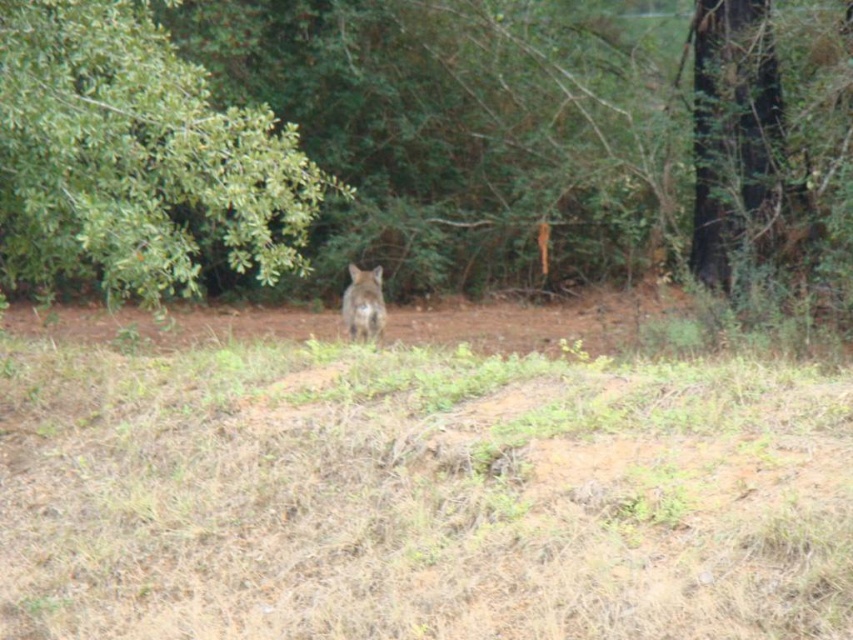
Is green leafy tree at upper left thinner than brown rough bark tree at upper right?

In fact, green leafy tree at upper left might be wider than brown rough bark tree at upper right.

Is the position of green leafy tree at upper left more distant than that of brown rough bark tree at upper right?

No, it is not.

Find the location of a particular element. This screenshot has width=853, height=640. green leafy tree at upper left is located at coordinates (136, 160).

Find the location of `green leafy tree at upper left`. green leafy tree at upper left is located at coordinates (136, 160).

Does point (729, 65) come farther from viewer compared to point (366, 321)?

Yes, point (729, 65) is farther from viewer.

Can you confirm if brown rough bark tree at upper right is bigger than brown fur at center?

Indeed, brown rough bark tree at upper right has a larger size compared to brown fur at center.

Which is in front, point (751, 128) or point (372, 308)?

Point (372, 308)

Image resolution: width=853 pixels, height=640 pixels. I want to click on brown rough bark tree at upper right, so click(x=735, y=132).

The width and height of the screenshot is (853, 640). What do you see at coordinates (136, 160) in the screenshot?
I see `green leafy tree at upper left` at bounding box center [136, 160].

Who is positioned more to the right, green leafy tree at upper left or brown fur at center?

Positioned to the right is brown fur at center.

Which is behind, point (207, 83) or point (369, 321)?

The point (207, 83) is behind.

Find the location of a particular element. The image size is (853, 640). green leafy tree at upper left is located at coordinates (136, 160).